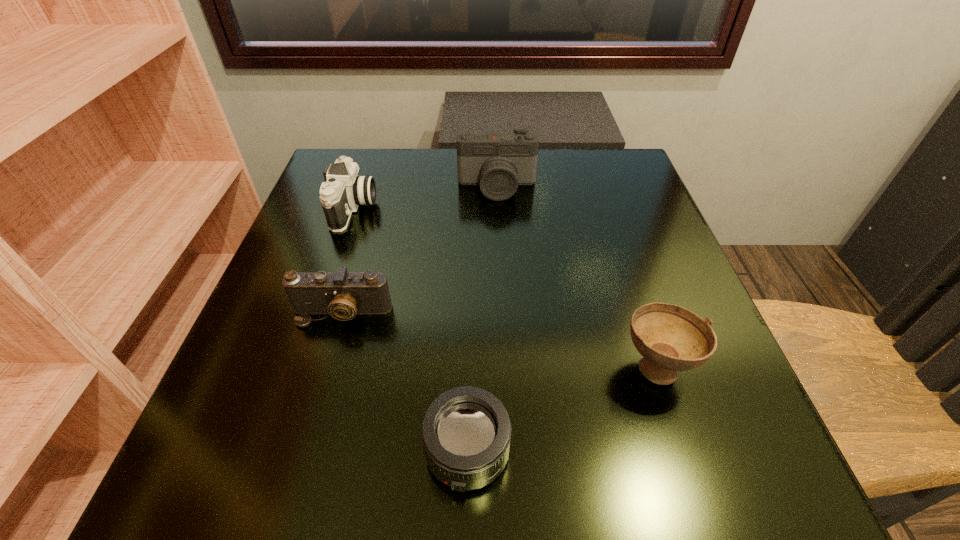
This screenshot has width=960, height=540. Find the location of `the rightmost camera`. the rightmost camera is located at coordinates (498, 162).

This screenshot has width=960, height=540. What are the coordinates of `the rightmost object` in the screenshot? It's located at (670, 338).

This screenshot has width=960, height=540. Find the location of `the fourth farthest object`. the fourth farthest object is located at coordinates (670, 338).

In order to click on the third nearest object in this screenshot , I will do `click(343, 295)`.

You are a GUI agent. You are given a task and a screenshot of the screen. Output one action in this format:
    pyautogui.click(x=<x>, y=<y>)
    Task: Click on the nearest camera
    Image resolution: width=960 pixels, height=540 pixels.
    Given the screenshot: What is the action you would take?
    pyautogui.click(x=343, y=295)

You are a GUI agent. You are given a task and a screenshot of the screen. Output one action in this format:
    pyautogui.click(x=<x>, y=<y>)
    Task: Click on the nearest object
    This screenshot has height=540, width=960.
    Given the screenshot: What is the action you would take?
    pyautogui.click(x=466, y=431)

You are a GUI agent. You are given a task and a screenshot of the screen. Output one action in this format:
    pyautogui.click(x=<x>, y=<y>)
    Task: Click on the vacant area located at the lens of the rightmost camera
    The image size is (960, 540).
    Given the screenshot: What is the action you would take?
    pyautogui.click(x=502, y=291)

Find the location of a particular element. This screenshot has height=540, width=960. vacant region located 0.380m on the back of the soup bowl is located at coordinates (602, 202).

Find the location of `vacant space situated on the front-facing side of the third nearest object`. vacant space situated on the front-facing side of the third nearest object is located at coordinates pyautogui.click(x=308, y=430).

I want to click on object at the near edge, so click(466, 431).